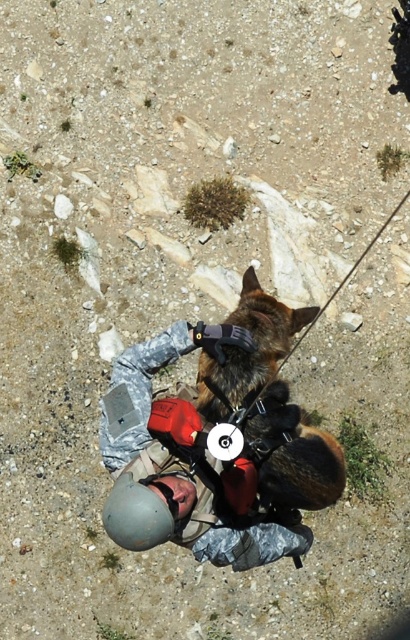
Question: Which point is farther to the camera?

Choices:
 (A) (138, 534)
 (B) (262, 548)
 (C) (204, 412)

Answer: (C)

Question: Is brown fur dog at center bigger than gray matte helmet at lower center?

Choices:
 (A) no
 (B) yes

Answer: (B)

Question: Which point is closer to the camera?

Choices:
 (A) camouflage fabric helmet at center
 (B) brown fur dog at center
 (C) gray matte helmet at lower center

Answer: (C)

Question: Is camouflage fabric helmet at center positioned in front of gray matte helmet at lower center?

Choices:
 (A) yes
 (B) no

Answer: (B)

Question: Which point is farther to the camera?

Choices:
 (A) gray matte helmet at lower center
 (B) camouflage fabric helmet at center
 (C) brown fur dog at center

Answer: (C)

Question: Is camouflage fabric helmet at center bigger than gray matte helmet at lower center?

Choices:
 (A) yes
 (B) no

Answer: (A)